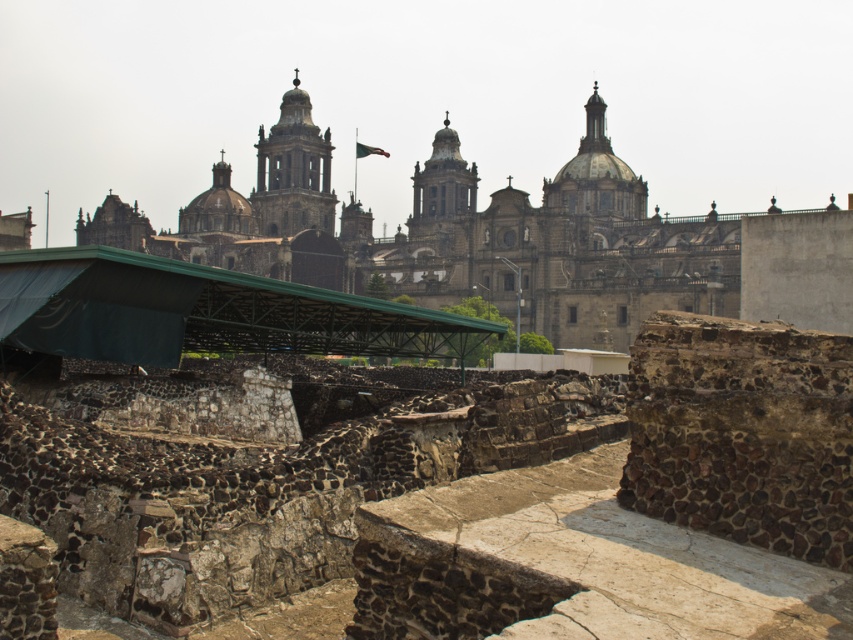
Question: Does brown stone ruins at center appear on the left side of smooth stone tower at center?

Choices:
 (A) no
 (B) yes

Answer: (A)

Question: Which object is farther from the camera taking this photo?

Choices:
 (A) brown stone ruins at center
 (B) smooth stone tower at center

Answer: (B)

Question: Is brown stone ruins at center smaller than smooth stone tower at center?

Choices:
 (A) no
 (B) yes

Answer: (A)

Question: Can you confirm if brown stone ruins at center is bigger than smooth stone tower at center?

Choices:
 (A) yes
 (B) no

Answer: (A)

Question: Which object is closer to the camera taking this photo?

Choices:
 (A) smooth stone tower at center
 (B) brown stone ruins at center

Answer: (B)